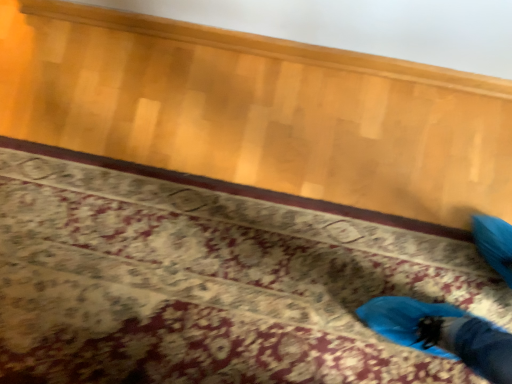
Locate an element on the screen. This screenshot has height=384, width=512. vacant space underneath patterned carpet at center (from a real-world perspective) is located at coordinates (219, 297).